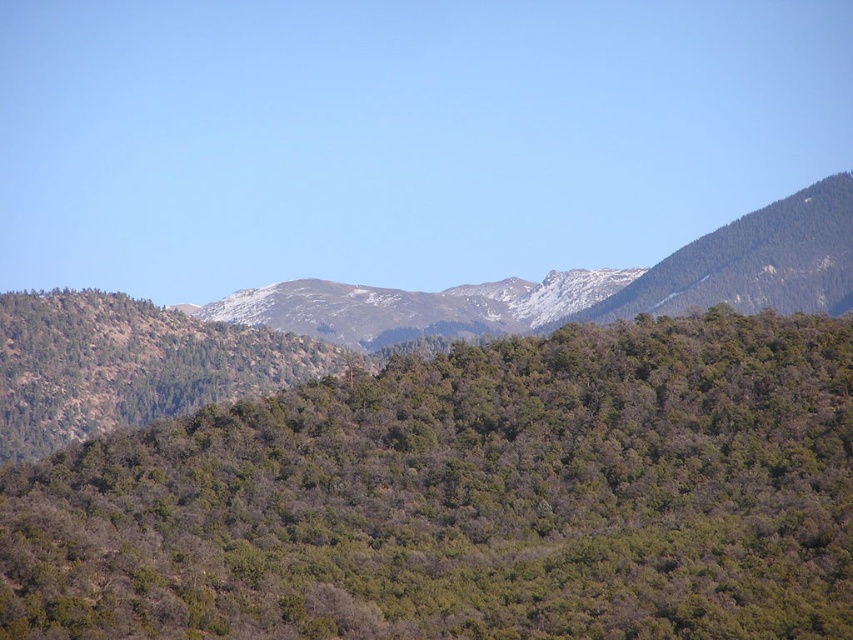
Is green leafy trees at center smaller than green leafy forest at center?

Incorrect, green leafy trees at center is not smaller in size than green leafy forest at center.

Does green leafy trees at center have a greater width compared to green leafy forest at center?

In fact, green leafy trees at center might be narrower than green leafy forest at center.

Where is `green leafy trees at center`? This screenshot has height=640, width=853. green leafy trees at center is located at coordinates (468, 499).

What are the coordinates of `green leafy trees at center` in the screenshot? It's located at (468, 499).

Is green leafy forest at center shorter than snowy rocky mountain range at center?

In fact, green leafy forest at center may be taller than snowy rocky mountain range at center.

Who is more distant from viewer, (4,337) or (314,324)?

The point (4,337) is more distant.

This screenshot has height=640, width=853. I want to click on green leafy forest at center, so click(370, 323).

Identify the location of green leafy forest at center. (370, 323).

How much distance is there between green leafy trees at center and snowy rocky mountain range at center?

green leafy trees at center and snowy rocky mountain range at center are 233.38 meters apart from each other.

What do you see at coordinates (468, 499) in the screenshot?
I see `green leafy trees at center` at bounding box center [468, 499].

Is point (143, 588) closer to camera compared to point (671, 308)?

Yes, it is in front of point (671, 308).

The width and height of the screenshot is (853, 640). What are the coordinates of `green leafy trees at center` in the screenshot? It's located at (468, 499).